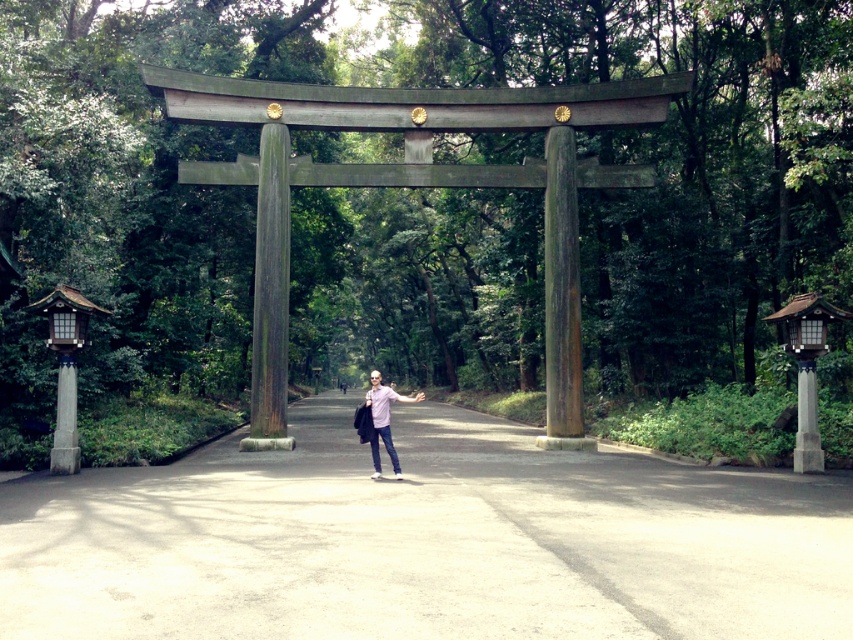
Is rusty wood pillar at center to the left of weathered wood pillar at center from the viewer's perspective?

In fact, rusty wood pillar at center is to the right of weathered wood pillar at center.

Does rusty wood pillar at center have a greater height compared to weathered wood pillar at center?

No.

Locate an element on the screen. rusty wood pillar at center is located at coordinates (561, 296).

Who is positioned more to the right, smooth concrete path at center or rusty wood pillar at center?

rusty wood pillar at center is more to the right.

Where is `smooth concrete path at center`? Image resolution: width=853 pixels, height=640 pixels. smooth concrete path at center is located at coordinates (424, 541).

Is point (848, 579) closer to viewer compared to point (572, 372)?

Yes, point (848, 579) is in front of point (572, 372).

Find the location of a particular element. smooth concrete path at center is located at coordinates (424, 541).

Looking at this image, who is more forward, (271, 250) or (379, 394)?

Point (379, 394)

Does point (277, 268) come closer to viewer compared to point (381, 420)?

No, it is not.

In order to click on weathered wood pillar at center in this screenshot , I will do `click(271, 285)`.